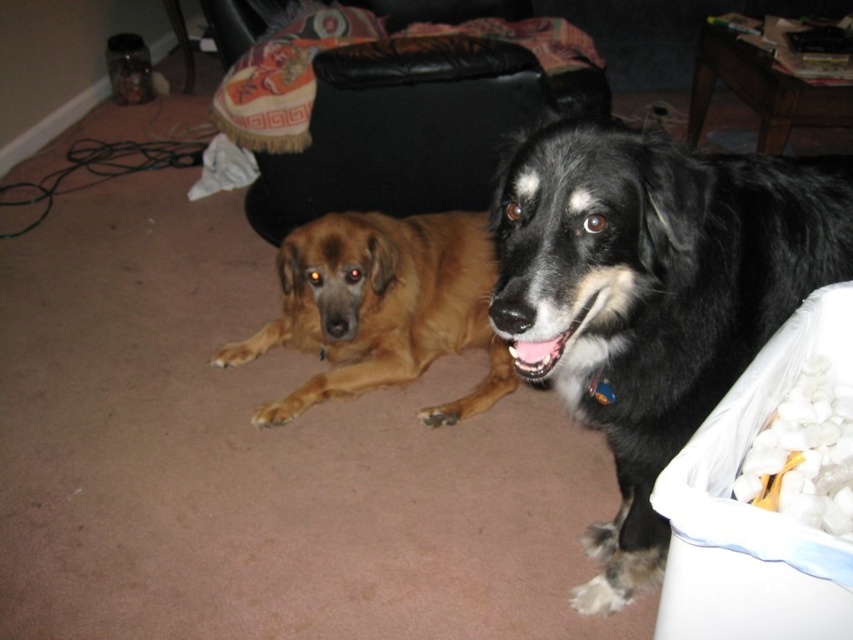
Question: Which point is farther to the camera?

Choices:
 (A) brown furry dog at center
 (B) black fur dog at right

Answer: (A)

Question: Is black fur dog at right smaller than brown furry dog at center?

Choices:
 (A) no
 (B) yes

Answer: (A)

Question: Does black fur dog at right appear over brown furry dog at center?

Choices:
 (A) yes
 (B) no

Answer: (B)

Question: Which of the following is the farthest from the observer?

Choices:
 (A) brown furry dog at center
 (B) black fur dog at right

Answer: (A)

Question: Does black fur dog at right have a smaller size compared to brown furry dog at center?

Choices:
 (A) no
 (B) yes

Answer: (A)